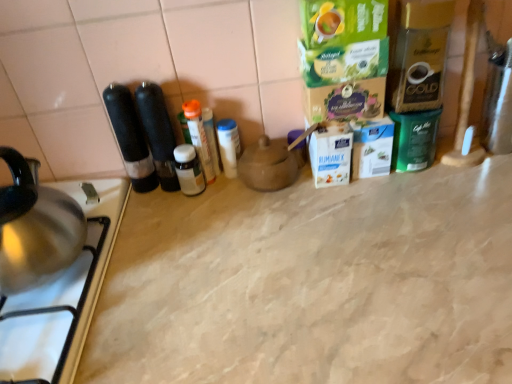
Question: Does white plastic container at center, the first bottle positioned from the right, have a larger size compared to matte brown teapot at center?

Choices:
 (A) yes
 (B) no

Answer: (B)

Question: Considering the relative positions of white plastic container at center, the first bottle positioned from the right, and matte brown teapot at center in the image provided, is white plastic container at center, the first bottle positioned from the right, behind matte brown teapot at center?

Choices:
 (A) no
 (B) yes

Answer: (B)

Question: Is white plastic container at center, the first bottle positioned from the right, far away from matte brown teapot at center?

Choices:
 (A) no
 (B) yes

Answer: (A)

Question: From the image's perspective, is white plastic container at center, the 3th bottle in the left-to-right sequence, over matte brown teapot at center?

Choices:
 (A) no
 (B) yes

Answer: (B)

Question: Can you confirm if white plastic container at center, the 3th bottle in the left-to-right sequence, is wider than matte brown teapot at center?

Choices:
 (A) yes
 (B) no

Answer: (B)

Question: Is white plastic container at center, the 3th bottle in the left-to-right sequence, oriented towards matte brown teapot at center?

Choices:
 (A) no
 (B) yes

Answer: (A)

Question: Considering the relative positions of matte brown teapot at center and translucent plastic bottle at center, placed as the second bottle when sorted from left to right, in the image provided, is matte brown teapot at center in front of translucent plastic bottle at center, placed as the second bottle when sorted from left to right,?

Choices:
 (A) no
 (B) yes

Answer: (B)

Question: From a real-world perspective, does matte brown teapot at center sit lower than translucent plastic bottle at center, placed as the second bottle when sorted from left to right?

Choices:
 (A) yes
 (B) no

Answer: (A)

Question: Could you tell me if matte brown teapot at center is turned towards translucent plastic bottle at center, the 2th bottle from the right?

Choices:
 (A) no
 (B) yes

Answer: (A)

Question: Does matte brown teapot at center appear on the right side of translucent plastic bottle at center, the 2th bottle from the right?

Choices:
 (A) yes
 (B) no

Answer: (A)

Question: Can you confirm if matte brown teapot at center is bigger than translucent plastic bottle at center, placed as the second bottle when sorted from left to right?

Choices:
 (A) no
 (B) yes

Answer: (B)

Question: Does matte brown teapot at center have a smaller size compared to translucent plastic bottle at center, placed as the second bottle when sorted from left to right?

Choices:
 (A) no
 (B) yes

Answer: (A)

Question: Is the depth of matte brown teapot at center greater than that of stainless steel gas stove at lower left?

Choices:
 (A) no
 (B) yes

Answer: (B)